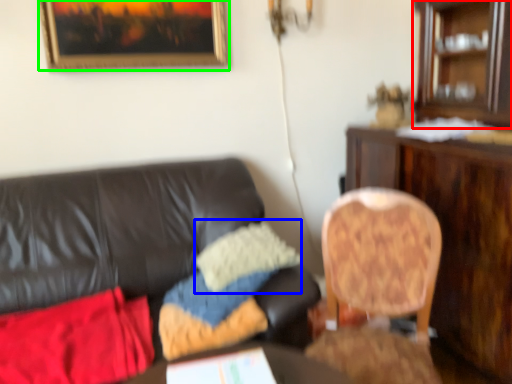
Question: Which object is the farthest from cabinetry (highlighted by a red box)? Choose among these: pillow (highlighted by a blue box) or picture frame (highlighted by a green box).

Choices:
 (A) pillow
 (B) picture frame

Answer: (B)